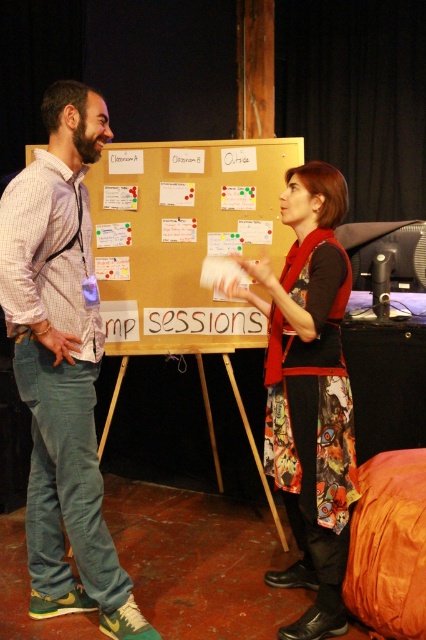
Question: Which point is farther to the camera?

Choices:
 (A) (203, 326)
 (B) (340, 611)
 (C) (43, 321)

Answer: (A)

Question: Which is nearer to the matte plaid shirt at left?

Choices:
 (A) gold matte bulletin board at center
 (B) printed fabric dress at center

Answer: (B)

Question: Is matte plaid shirt at left further to camera compared to printed fabric dress at center?

Choices:
 (A) no
 (B) yes

Answer: (A)

Question: Does matte plaid shirt at left come behind gold matte bulletin board at center?

Choices:
 (A) no
 (B) yes

Answer: (A)

Question: Which point appears closest to the camera in this image?

Choices:
 (A) (55, 595)
 (B) (255, 248)
 (C) (342, 486)

Answer: (C)

Question: Can you confirm if gold matte bulletin board at center is smaller than printed fabric dress at center?

Choices:
 (A) yes
 (B) no

Answer: (A)